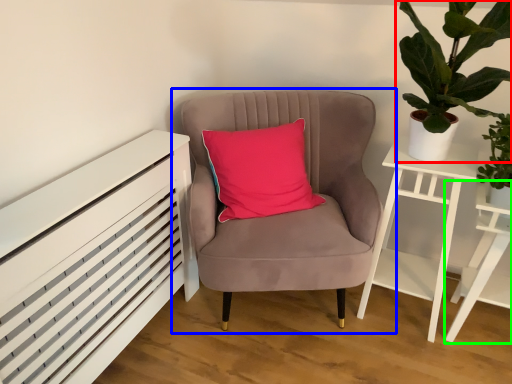
Question: Which object is positioned closest to houseplant (highlighted by a red box)? Select from chair (highlighted by a blue box) and table (highlighted by a green box).

Choices:
 (A) chair
 (B) table

Answer: (A)